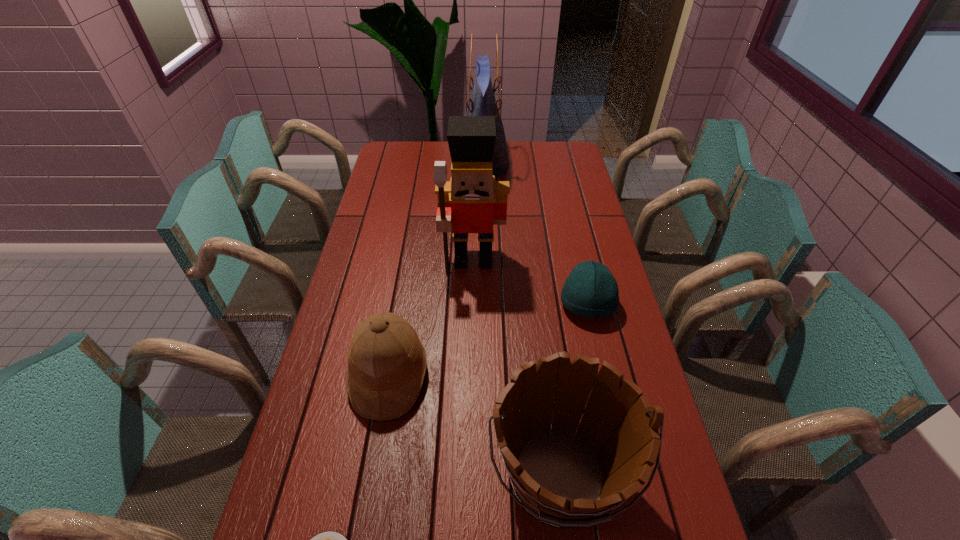
Locate an element on the screen. This screenshot has height=540, width=960. object that is at the left edge is located at coordinates pos(387,363).

The image size is (960, 540). What are the coordinates of `object situated at the right edge` in the screenshot? It's located at (590, 290).

Locate an element on the screen. vacant space at the far edge of the desktop is located at coordinates (427, 143).

Where is `vacant area at the left edge of the desktop`? The height and width of the screenshot is (540, 960). vacant area at the left edge of the desktop is located at coordinates (368, 240).

In the image, there is a desktop. Where is `vacant space at the right edge`? The width and height of the screenshot is (960, 540). vacant space at the right edge is located at coordinates (567, 231).

The width and height of the screenshot is (960, 540). What are the coordinates of `free region at the far left corner of the desktop` in the screenshot? It's located at (400, 158).

This screenshot has height=540, width=960. What are the coordinates of `free space that is in between the second farthest object and the beanie` in the screenshot? It's located at (530, 282).

This screenshot has width=960, height=540. I want to click on vacant space that is in between the fourth nearest object and the farthest object, so [535, 234].

Identify the location of the fifth closest object to the hat. pyautogui.click(x=482, y=102).

Identify the location of object that is the third closest to the third farthest object. The height and width of the screenshot is (540, 960). [x=387, y=363].